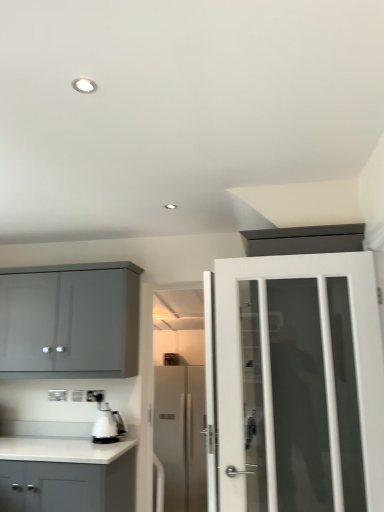
Find the location of a particular element. The image size is (384, 512). blank space situated above white glass door at right, which is the 1th door in top-to-bottom order (from a real-world perspective) is located at coordinates (304, 251).